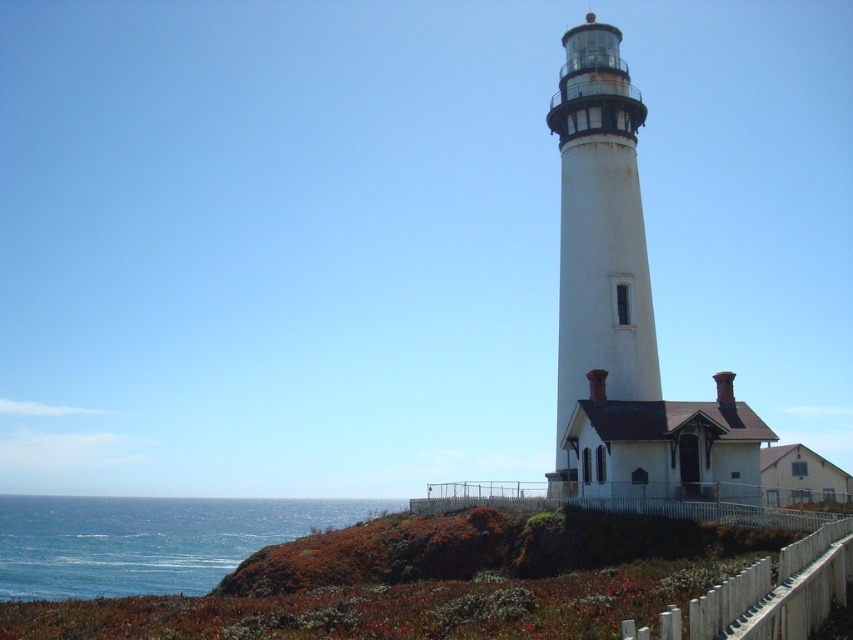
Does white painted metal tower at center have a lesser width compared to blue water at lower left?

Yes, white painted metal tower at center is thinner than blue water at lower left.

The height and width of the screenshot is (640, 853). I want to click on white painted metal tower at center, so click(599, 236).